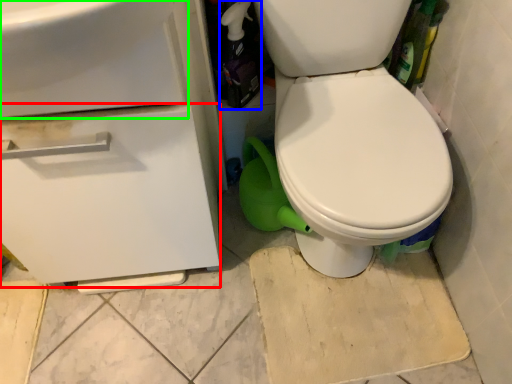
Question: Considering the real-world distances, which object is closest to drawer (highlighted by a red box)? bottle (highlighted by a blue box) or sink (highlighted by a green box).

Choices:
 (A) bottle
 (B) sink

Answer: (B)